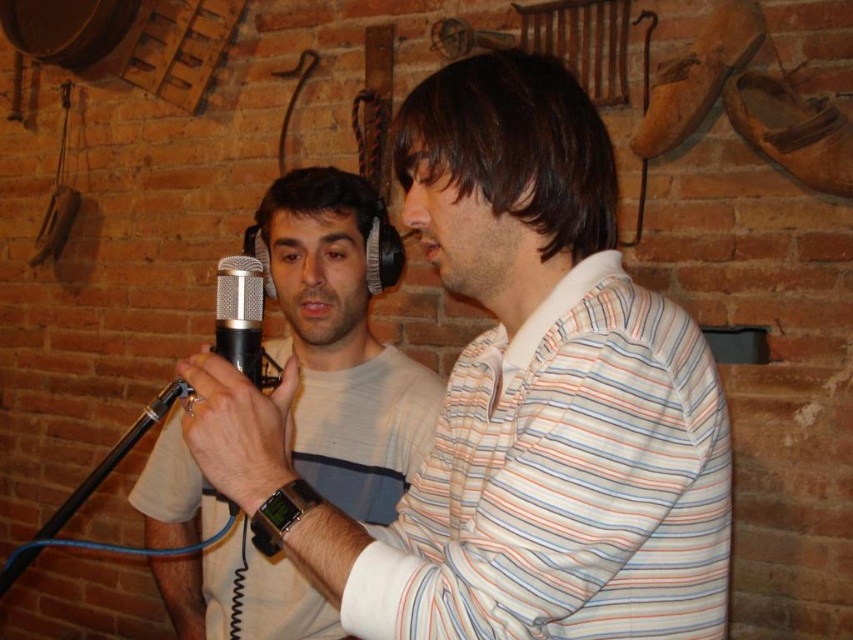
Which is behind, point (322, 316) or point (218, 296)?

Positioned behind is point (322, 316).

Consider the image. Who is lower down, white matte t-shirt at center or silver metallic microphone at center?

white matte t-shirt at center

Image resolution: width=853 pixels, height=640 pixels. In order to click on white matte t-shirt at center in this screenshot , I will do `click(341, 340)`.

Find the location of a particular element. This screenshot has height=640, width=853. white matte t-shirt at center is located at coordinates (341, 340).

Describe the element at coordinates (514, 401) in the screenshot. This screenshot has height=640, width=853. I see `white striped shirt at center` at that location.

Who is lower down, white striped shirt at center or silver metallic microphone at center?

Positioned lower is white striped shirt at center.

The image size is (853, 640). In order to click on white striped shirt at center in this screenshot , I will do `click(514, 401)`.

Does white striped shirt at center appear on the right side of white matte t-shirt at center?

Correct, you'll find white striped shirt at center to the right of white matte t-shirt at center.

Between white striped shirt at center and white matte t-shirt at center, which one appears on the right side from the viewer's perspective?

Positioned to the right is white striped shirt at center.

The image size is (853, 640). Identify the location of white striped shirt at center. (514, 401).

Locate an element on the screen. The image size is (853, 640). white striped shirt at center is located at coordinates (514, 401).